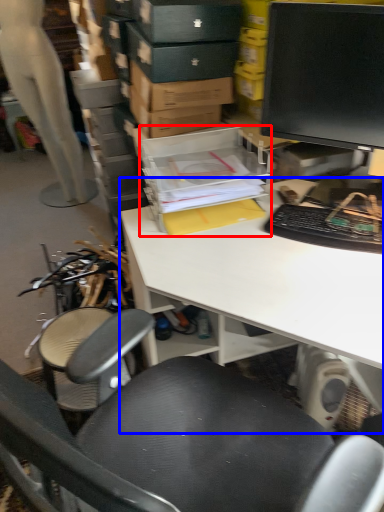
Question: Which object appears farthest to the camera in this image, storage box (highlighted by a red box) or desk (highlighted by a blue box)?

Choices:
 (A) storage box
 (B) desk

Answer: (A)